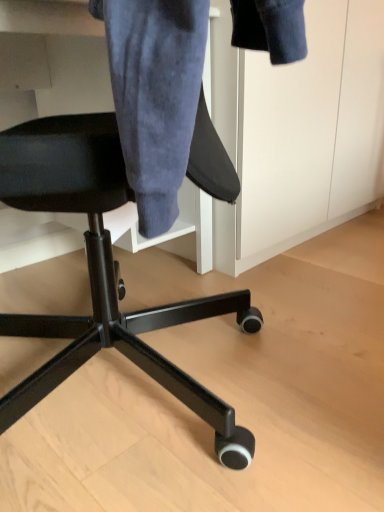
Question: From their relative heights in the image, would you say denim jacket at upper center is taller or shorter than black fabric chair at center?

Choices:
 (A) tall
 (B) short

Answer: (A)

Question: Relative to black fabric chair at center, is denim jacket at upper center in front or behind?

Choices:
 (A) front
 (B) behind

Answer: (B)

Question: Is denim jacket at upper center wider or thinner than black fabric chair at center?

Choices:
 (A) wide
 (B) thin

Answer: (B)

Question: Is black fabric chair at center spatially inside denim jacket at upper center, or outside of it?

Choices:
 (A) outside
 (B) inside

Answer: (A)

Question: Is black fabric chair at center wider or thinner than denim jacket at upper center?

Choices:
 (A) thin
 (B) wide

Answer: (B)

Question: Is point (228, 446) closer or farther from the camera than point (112, 1)?

Choices:
 (A) closer
 (B) farther

Answer: (B)

Question: In terms of height, does black fabric chair at center look taller or shorter compared to denim jacket at upper center?

Choices:
 (A) short
 (B) tall

Answer: (A)